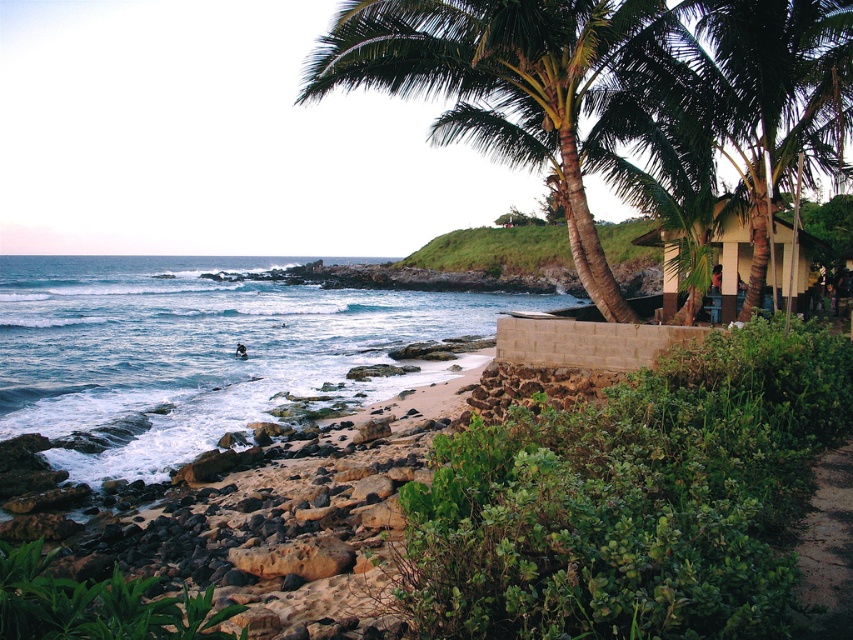
Question: Among these objects, which one is nearest to the camera?

Choices:
 (A) green grass at lower right
 (B) brown wooden hut at right
 (C) blue water at lower left
 (D) green leafy palm tree at upper right

Answer: (A)

Question: Is blue water at lower left to the right of brown wooden hut at right from the viewer's perspective?

Choices:
 (A) yes
 (B) no

Answer: (B)

Question: Does brown wooden hut at right appear on the left side of green grass at lower right?

Choices:
 (A) no
 (B) yes

Answer: (A)

Question: Is blue water at lower left wider than brown wooden hut at right?

Choices:
 (A) yes
 (B) no

Answer: (A)

Question: Based on their relative distances, which object is farther from the blue water at lower left?

Choices:
 (A) green leafy palm tree at upper right
 (B) green grass at lower right
 (C) brown wooden hut at right

Answer: (B)

Question: Which of the following is the farthest from the observer?

Choices:
 (A) (811, 563)
 (B) (424, 330)
 (C) (448, 118)
 (D) (785, 289)

Answer: (B)